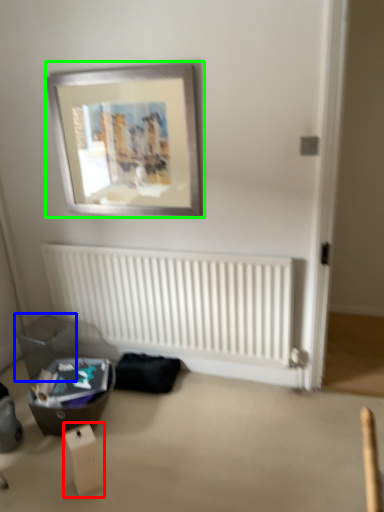
Question: Which object is the farthest from cardboard box (highlighted by a red box)? Choose among these: storage box (highlighted by a blue box) or picture frame (highlighted by a green box).

Choices:
 (A) storage box
 (B) picture frame

Answer: (B)